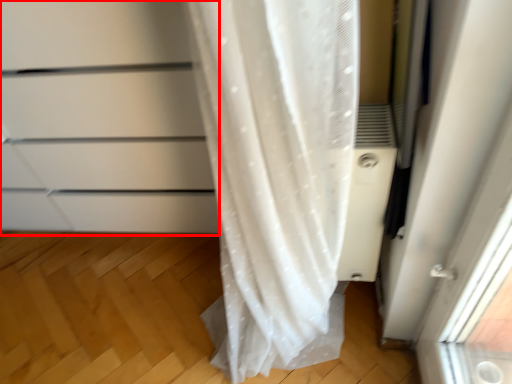
Question: From the image's perspective, where is cabinetry (annotated by the red box) located relative to air conditioner?

Choices:
 (A) above
 (B) below

Answer: (A)